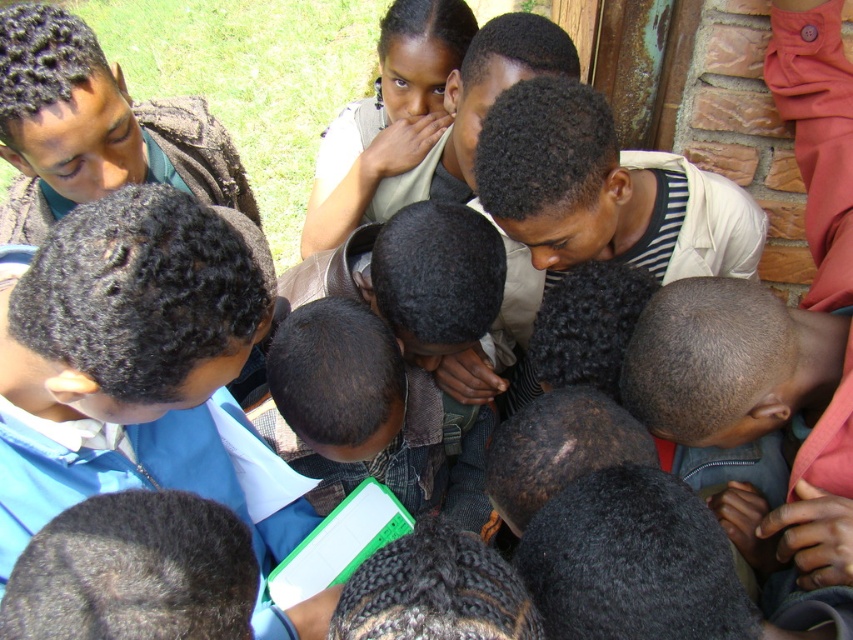
Question: Does blue fabric shirt at center appear under matte beige shirt at center?

Choices:
 (A) no
 (B) yes

Answer: (B)

Question: Is blue fabric shirt at center to the right of matte beige shirt at center from the viewer's perspective?

Choices:
 (A) no
 (B) yes

Answer: (A)

Question: Which point is closer to the camera?

Choices:
 (A) (83, 445)
 (B) (434, 132)

Answer: (A)

Question: From the image, what is the correct spatial relationship of blue fabric shirt at center in relation to matte beige shirt at center?

Choices:
 (A) left
 (B) right

Answer: (A)

Question: Among these objects, which one is nearest to the camera?

Choices:
 (A) blue fabric shirt at center
 (B) matte beige shirt at center

Answer: (A)